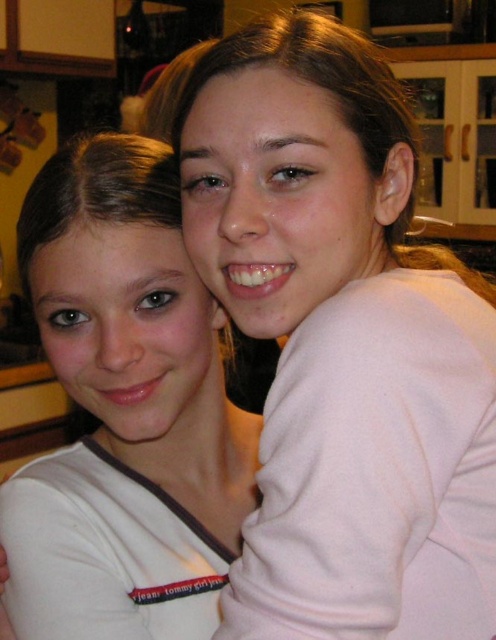
You are trying to decide which item to purchase between the pink matte sweater at upper right and the white matte shirt at center. Based on their positions in the image, which one is located to the right of the other?

The pink matte sweater at upper right is positioned on the right side of white matte shirt at center.

You are a photographer setting up a shoot in this indoor scene. You need to adjust the lighting so that the pink matte sweater at upper right and the white matte shirt at center are both well lit. Since the sweater is closer to you, where should you position the main light to ensure both items receive adequate illumination?

The pink matte sweater at upper right is closer to the viewer than the white matte shirt at center. To ensure both are well lit, position the main light slightly behind the sweater so that the light reaches both the closer sweater and the shirt further back, balancing their exposure.

You are standing in a room with two people. You see a point marked at coordinates (343, 342). What object is located at that point?

The point at coordinates (343, 342) marks the pink matte sweater at upper right.